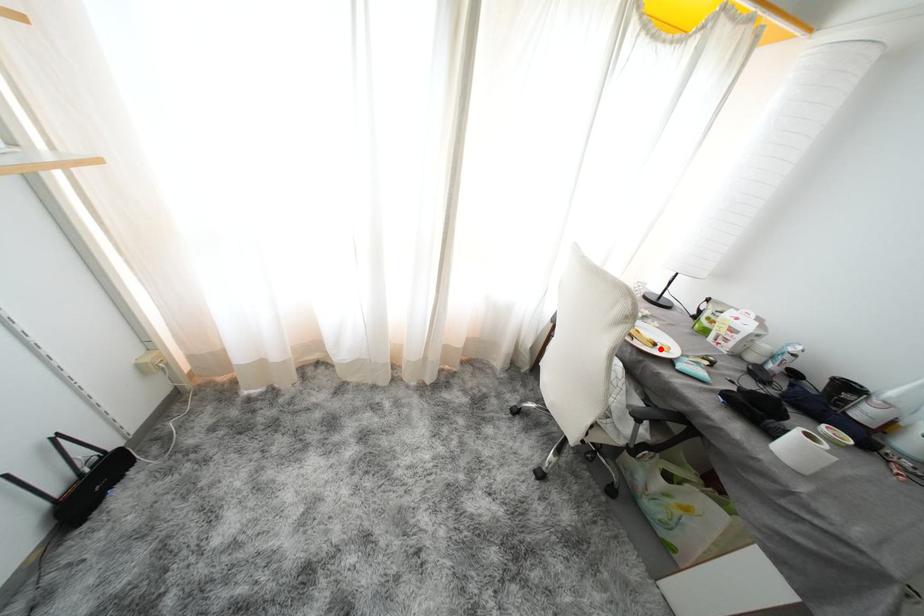
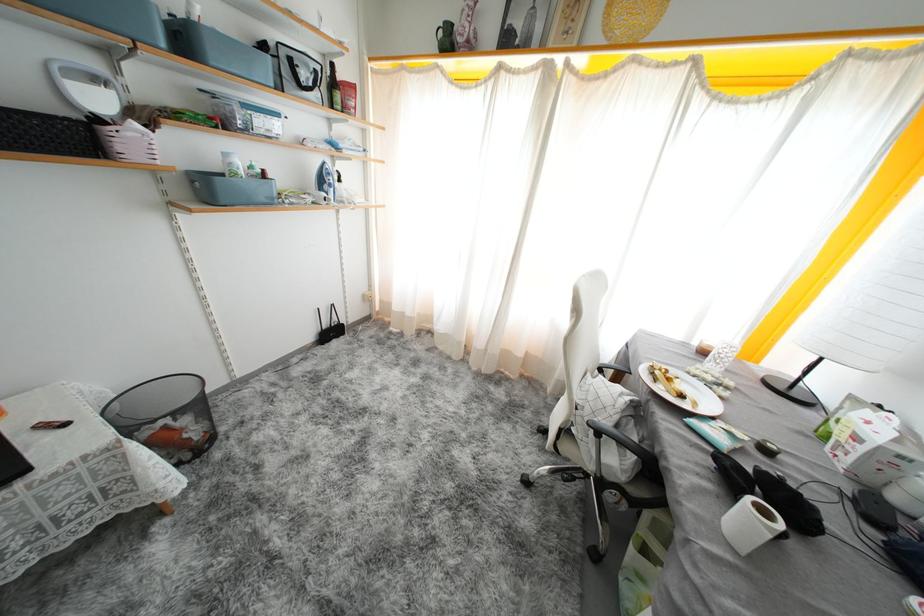
The point at the highlighted location is marked in the first image. Where is the corresponding point in the second image?

(687, 400)